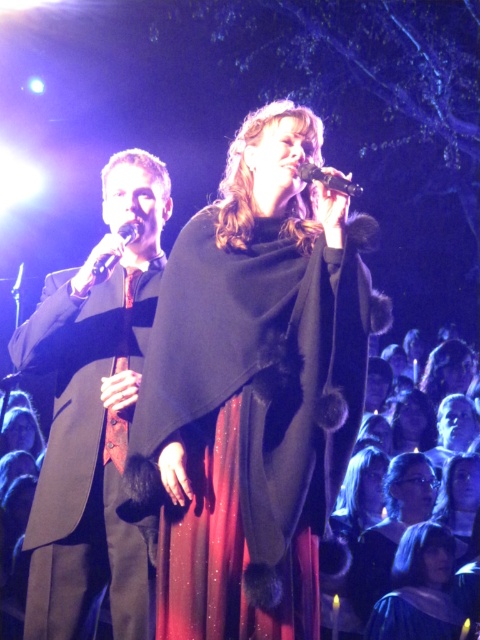
Question: Observing the image, what is the correct spatial positioning of velvet burgundy dress at center in reference to velvet purple dress at center?

Choices:
 (A) left
 (B) right

Answer: (B)

Question: Among these points, which one is nearest to the camera?

Choices:
 (A) (103, 257)
 (B) (49, 300)
 (C) (407, 600)
 (D) (216, 556)

Answer: (D)

Question: Which point is farther to the camera?

Choices:
 (A) shiny black dress at center
 (B) matte black suit at left
 (C) velvet burgundy dress at center
 (D) blue velvet gown at lower center

Answer: (C)

Question: Observing the image, what is the correct spatial positioning of velvet burgundy dress at center in reference to velvet purple dress at center?

Choices:
 (A) left
 (B) right

Answer: (B)

Question: Does velvet black cape at center appear on the left side of shiny black dress at center?

Choices:
 (A) yes
 (B) no

Answer: (A)

Question: Which point is closer to the camera?

Choices:
 (A) (427, 384)
 (B) (457, 532)
 (C) (302, 176)
 (D) (424, 449)

Answer: (C)